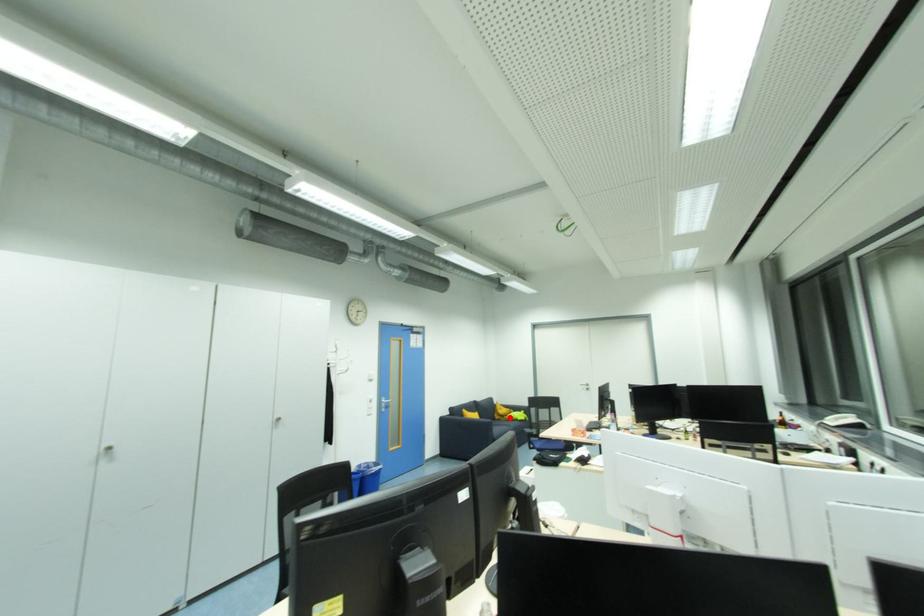
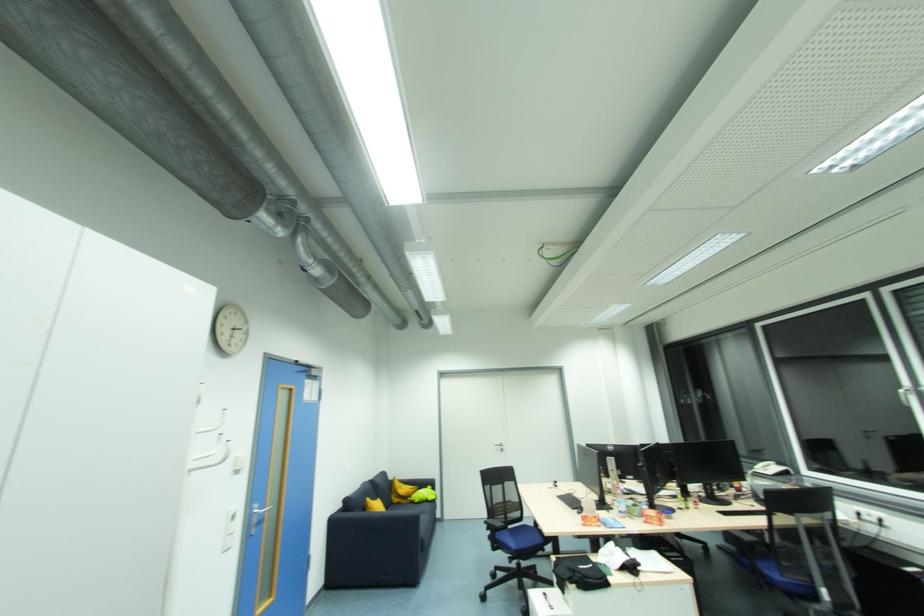
Question: A red point is marked in image1. In image2, is the corresponding 3D point closer to the camera or farther? Reply with the corresponding letter.

Choices:
 (A) The corresponding 3D point is closer.
 (B) The corresponding 3D point is farther.

Answer: (A)